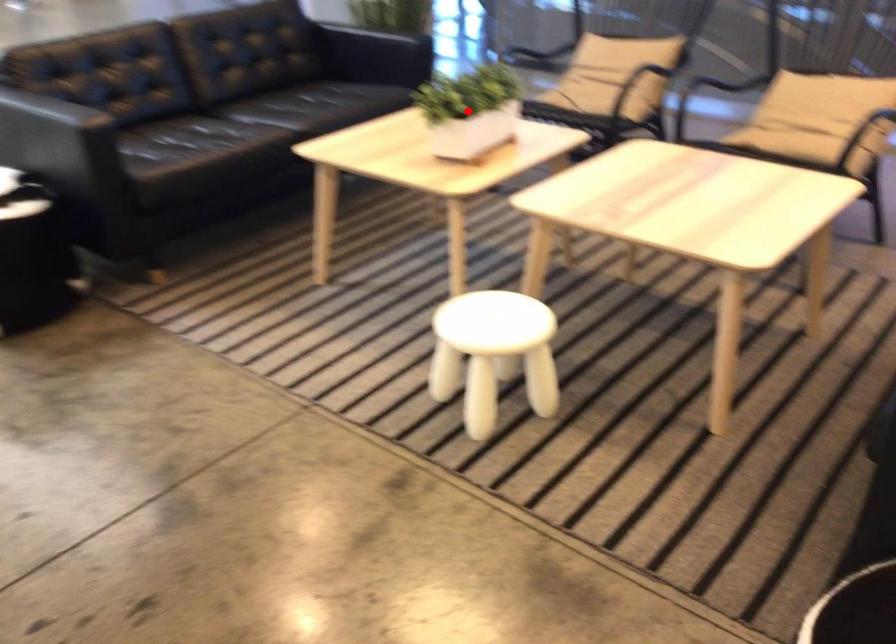
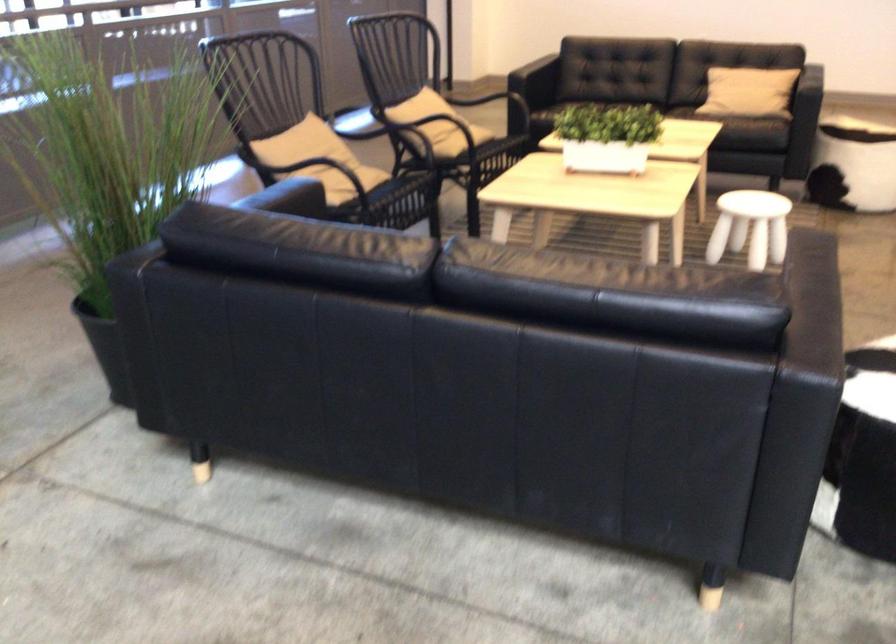
Question: I am providing you with two images of the same scene from different viewpoints. Image1 has a red point marked. In image2, the corresponding 3D location appears at what relative position? Reply with the corresponding letter.

Choices:
 (A) Closer
 (B) Farther

Answer: (B)